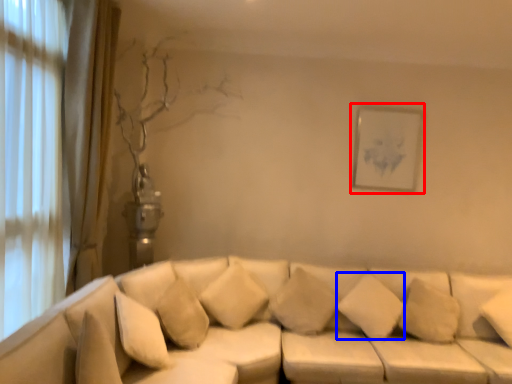
Question: Which object appears farthest to the camera in this image, picture frame (highlighted by a red box) or pillow (highlighted by a blue box)?

Choices:
 (A) picture frame
 (B) pillow

Answer: (A)